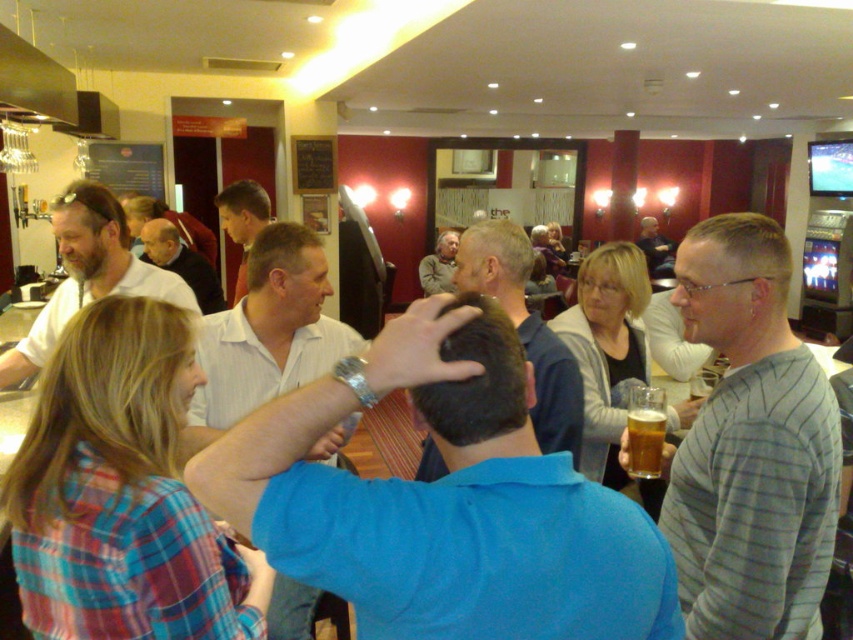
Does blue cotton shirt at center appear under matte white shirt at left?

Correct, blue cotton shirt at center is located below matte white shirt at left.

Is blue cotton shirt at center to the right of matte white shirt at left from the viewer's perspective?

Yes, blue cotton shirt at center is to the right of matte white shirt at left.

Is point (631, 593) positioned after point (80, 253)?

That is False.

You are a GUI agent. You are given a task and a screenshot of the screen. Output one action in this format:
    pyautogui.click(x=<x>, y=<y>)
    Task: Click on the blue cotton shirt at center
    
    Given the screenshot: What is the action you would take?
    pyautogui.click(x=444, y=500)

Which is more to the right, blue shirt at center or matte black jacket at center?

matte black jacket at center is more to the right.

What are the coordinates of `blue shirt at center` in the screenshot? It's located at (525, 328).

Does point (546, 385) come closer to viewer compared to point (662, 257)?

Yes, it is in front of point (662, 257).

Locate an element on the screen. The image size is (853, 640). blue shirt at center is located at coordinates (525, 328).

Can you confirm if gray striped sweater at right is shorter than white striped shirt at center?

In fact, gray striped sweater at right may be taller than white striped shirt at center.

Between point (815, 563) and point (247, 388), which one is positioned behind?

The point (247, 388) is behind.

Identify the location of gray striped sweater at right. Image resolution: width=853 pixels, height=640 pixels. (750, 445).